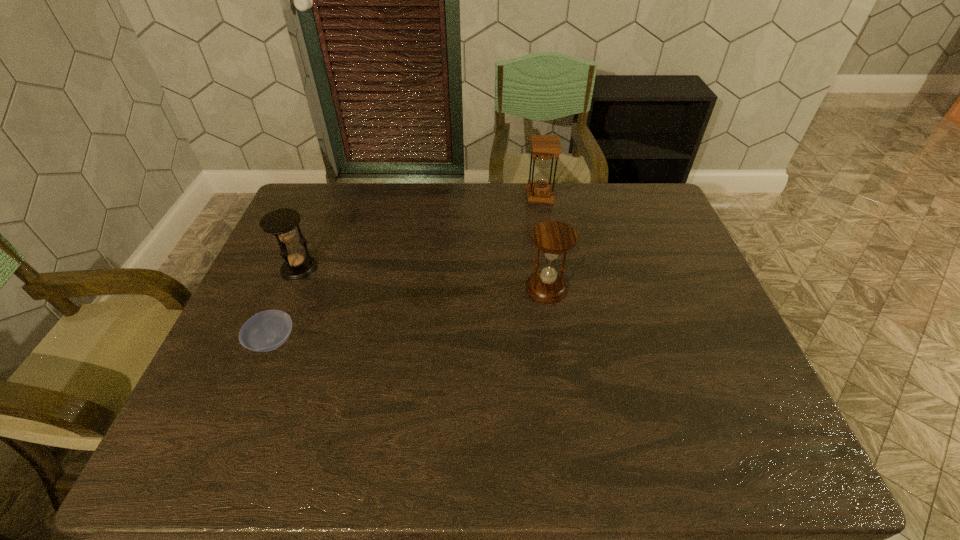
Locate an element on the screen. the farthest object is located at coordinates (539, 190).

Identify the location of the leftmost hourglass. (281, 222).

The width and height of the screenshot is (960, 540). I want to click on bowl, so click(x=265, y=331).

This screenshot has height=540, width=960. Find the location of `the nearest object`. the nearest object is located at coordinates (265, 331).

Where is `free point located 0.080m on the right of the farthest hourglass`? Image resolution: width=960 pixels, height=540 pixels. free point located 0.080m on the right of the farthest hourglass is located at coordinates (576, 197).

Where is `vacant space located on the back of the leftmost hourglass`? The image size is (960, 540). vacant space located on the back of the leftmost hourglass is located at coordinates (322, 214).

Where is `vacant space situated on the back of the shortest object`? vacant space situated on the back of the shortest object is located at coordinates (289, 302).

This screenshot has height=540, width=960. I want to click on object that is at the far edge, so 539,190.

Where is `hourglass present at the left edge`? hourglass present at the left edge is located at coordinates (281, 222).

Locate an element on the screen. The height and width of the screenshot is (540, 960). bowl located in the left edge section of the desktop is located at coordinates (265, 331).